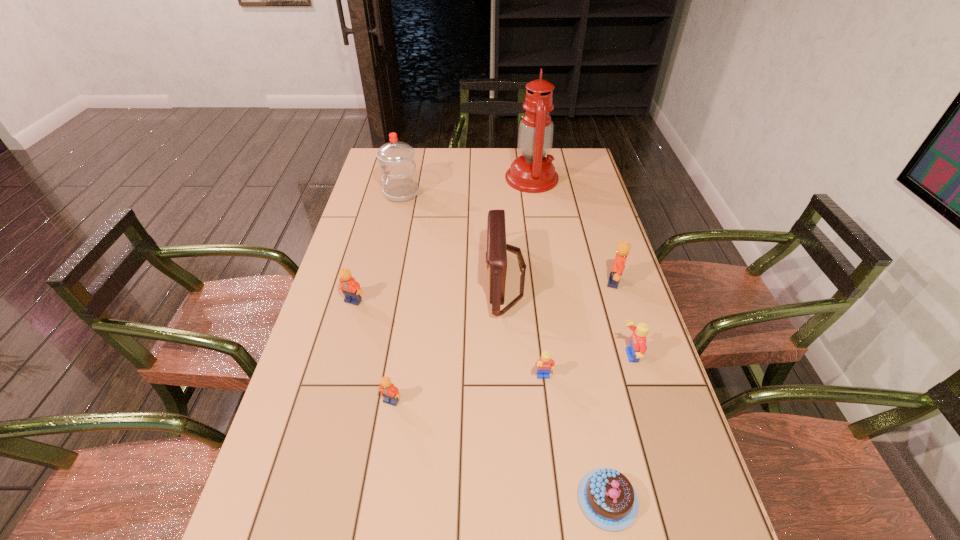
Where is `the tallest object`? the tallest object is located at coordinates (532, 172).

Identify the location of the second tallest object. (396, 159).

The height and width of the screenshot is (540, 960). I want to click on white water bottle, so point(396,159).

Where is `shoulder bag`? shoulder bag is located at coordinates (496, 256).

This screenshot has height=540, width=960. Identify the location of the farthest orange Lego. (623, 248).

Where is `the farthest Lego`? This screenshot has height=540, width=960. the farthest Lego is located at coordinates (623, 248).

Where is `the leftmost orange Lego`? the leftmost orange Lego is located at coordinates pos(351,289).

Where is `the second farthest Lego`? The image size is (960, 540). the second farthest Lego is located at coordinates (351, 289).

Find the location of a particular element. the sixth farthest object is located at coordinates click(x=637, y=348).

Locate an element on the screen. This screenshot has height=540, width=960. the third farthest Lego is located at coordinates (637, 348).